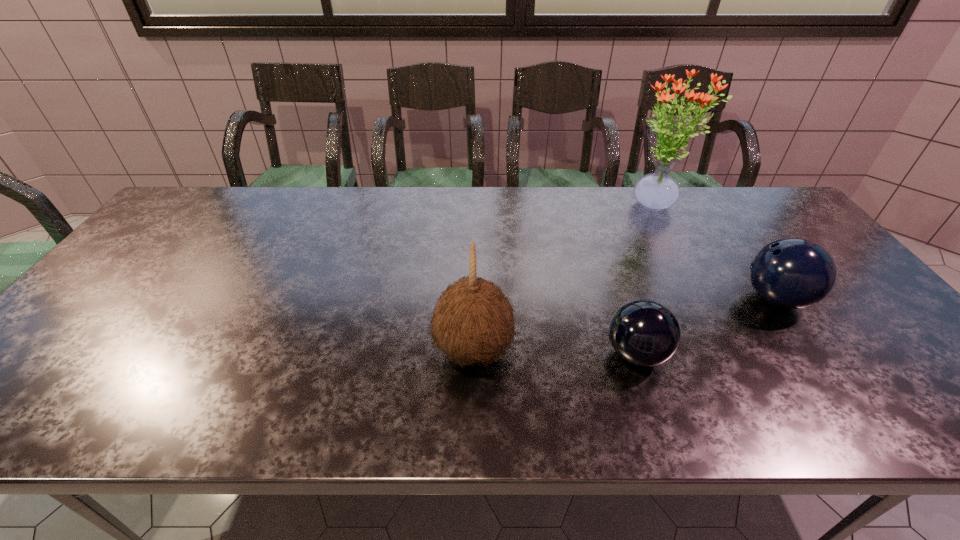
This screenshot has width=960, height=540. In the image, there is a desktop. Find the location of `vacant space at the right edge`. vacant space at the right edge is located at coordinates (846, 281).

Identify the location of free space at the far right corner of the desktop. (753, 220).

Locate an element on the screen. Image resolution: width=960 pixels, height=540 pixels. vacant point located between the second tallest object and the tallest object is located at coordinates (564, 278).

Identify the location of unoccupied position between the flower arrangement and the farther bowling ball. Image resolution: width=960 pixels, height=540 pixels. (715, 252).

At what (x,y) coordinates should I click in order to perform the action: click on free space between the farthest object and the coconut. Please return your answer as a coordinate pair (x, y). The image size is (960, 540). Looking at the image, I should click on (564, 278).

Where is `free space that is in between the nearer bowling ball and the farthest object`? This screenshot has width=960, height=540. free space that is in between the nearer bowling ball and the farthest object is located at coordinates (646, 279).

You are a GUI agent. You are given a task and a screenshot of the screen. Output one action in this format:
    pyautogui.click(x=<x>, y=<y>)
    Task: Click on the free area in between the farther bowling ball and the shorter bowling ball
    The height and width of the screenshot is (540, 960).
    Given the screenshot: What is the action you would take?
    pyautogui.click(x=706, y=326)

The image size is (960, 540). Find the location of `vacant area between the second tallest object and the shorter bowling ball`. vacant area between the second tallest object and the shorter bowling ball is located at coordinates (555, 352).

The height and width of the screenshot is (540, 960). I want to click on free space between the right bowling ball and the tallest object, so click(x=715, y=252).

Identify which object is located as the nearest to the third object from right to left. Please provide its 2D coordinates. Your answer should be formatted as a tuple, i.e. [(x, y)], where the tuple contains the x and y coordinates of a point satisfying the conditions above.

[(473, 322)]